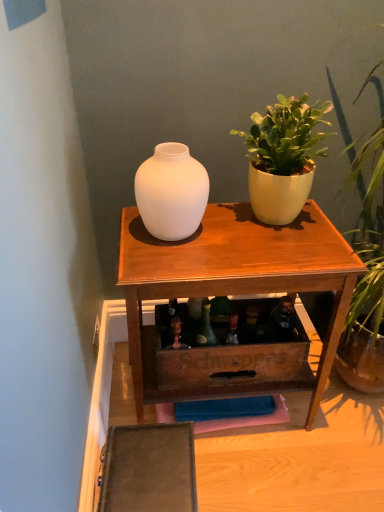
Find the location of a particular element. The height and width of the screenshot is (512, 384). vacant area that is in front of matte yellow pot at upper right is located at coordinates (275, 256).